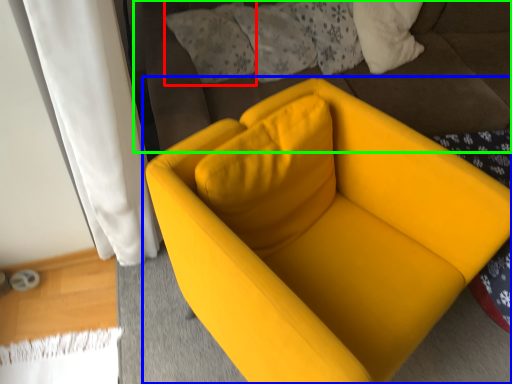
Question: Which object is positioned closest to pillow (highlighted by a red box)? Select from chair (highlighted by a blue box) and bedding (highlighted by a green box).

Choices:
 (A) chair
 (B) bedding

Answer: (B)